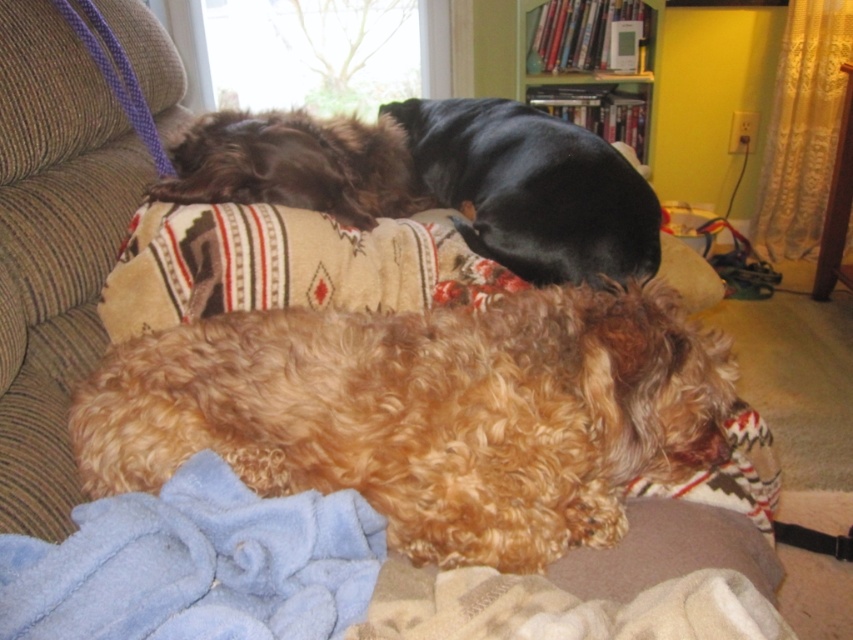
You are a delivery robot with a package that needs to be placed between the black smooth dog at upper center and the wooden bookshelf at upper center. The package is 1.1 meters long. Will it fit in the space between them?

The space between the black smooth dog at upper center and the wooden bookshelf at upper center is 1.20 meters. Since the package is 1.1 meters long, it will fit with 0.1 meters of space remaining.

You are a dog owner who wants to ensure both dogs have enough space on the couch. Given that the couch is 1.5 meters wide, can both the black smooth dog at upper center and the shaggy brown dog at upper center fit comfortably if they each need at least 0.7 meters of space?

The black smooth dog at upper center is larger in size than shaggy brown dog at upper center. Assuming the larger dog requires more space, they would need a combined minimum of 1.4 meters. Since the couch is 1.5 meters wide, there is enough space for both dogs to fit comfortably.

In the cozy indoor scene, there is a fuzzy brown dog at center and a wooden bookshelf at upper center. From the perspective of someone standing in front of the couch, which object is positioned to the left?

The fuzzy brown dog at center is to the left of the wooden bookshelf at upper center.